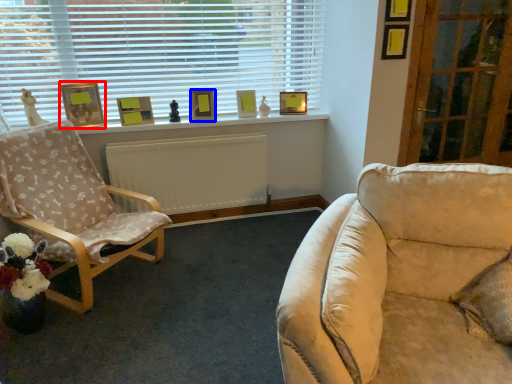
Question: Which object appears closest to the camera in this image, picture frame (highlighted by a red box) or picture frame (highlighted by a blue box)?

Choices:
 (A) picture frame
 (B) picture frame

Answer: (A)